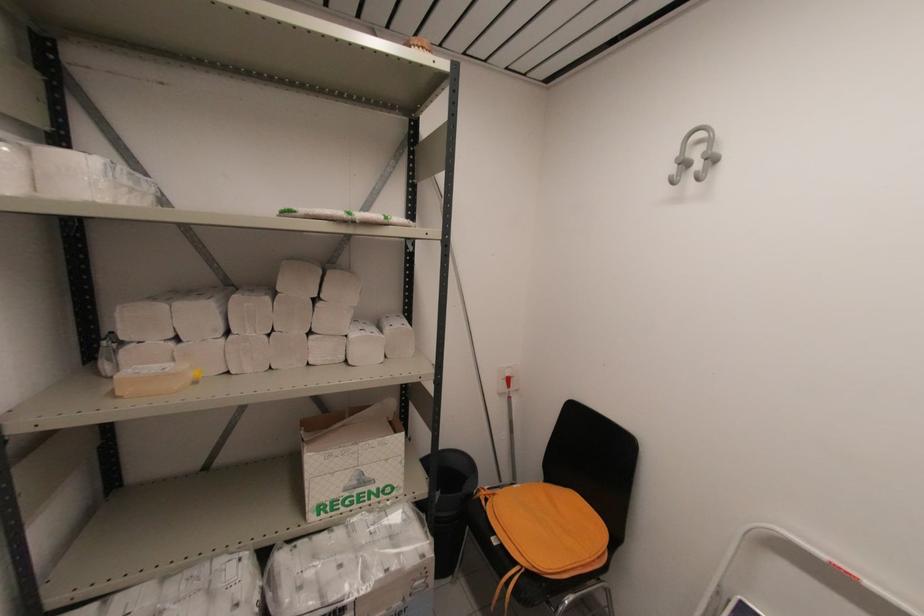
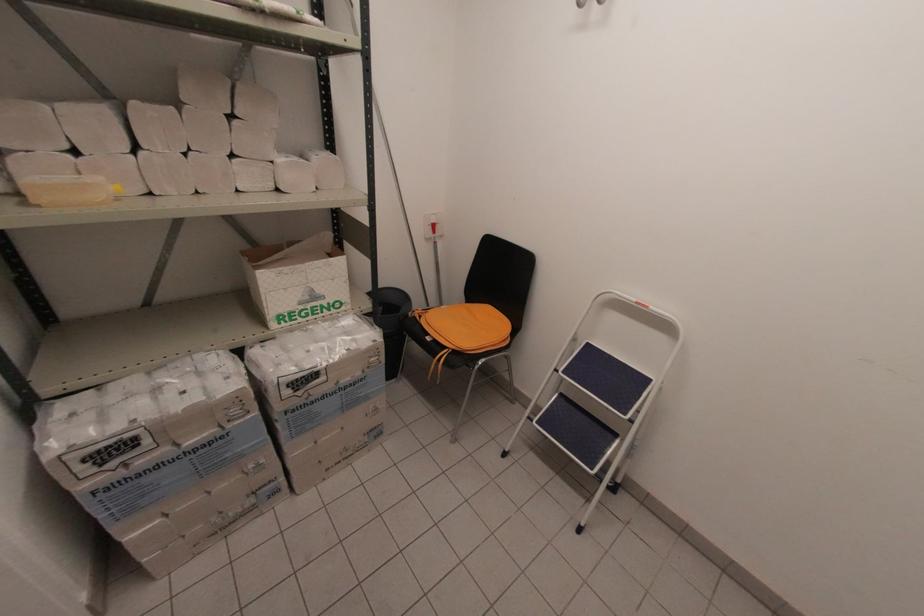
The point at (434, 556) is marked in the first image. Where is the corresponding point in the second image?

(383, 341)